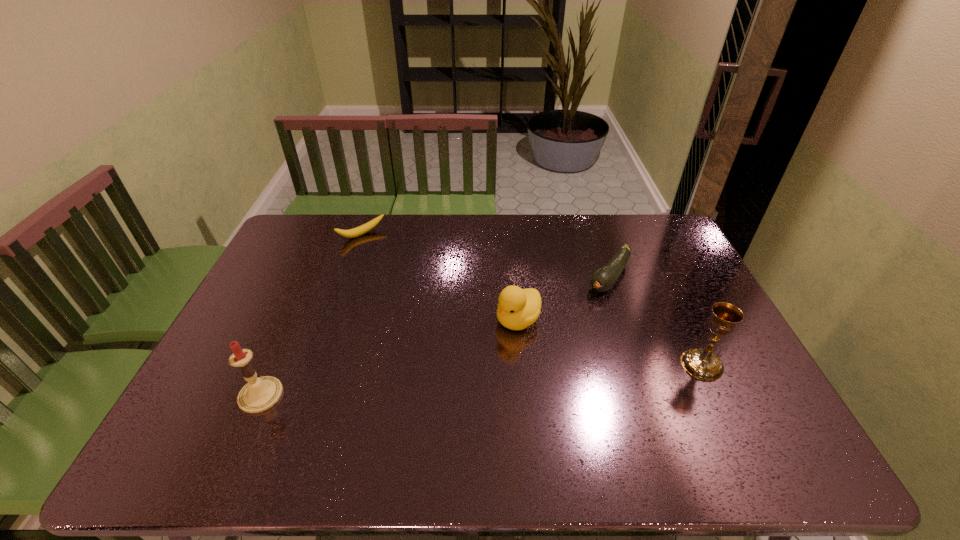
I want to click on vacant area situated 0.270m at the blossom end of the second farthest object, so click(551, 346).

Where is `free location located 0.170m at the blossom end of the second farthest object`? free location located 0.170m at the blossom end of the second farthest object is located at coordinates (570, 326).

Where is `vacant space situated on the front-facing side of the duck`? Image resolution: width=960 pixels, height=540 pixels. vacant space situated on the front-facing side of the duck is located at coordinates (444, 384).

Image resolution: width=960 pixels, height=540 pixels. What are the coordinates of `free space located 0.360m on the front-facing side of the duck` in the screenshot? It's located at (409, 414).

Where is `vacant area situated 0.090m on the front-facing side of the duck`? vacant area situated 0.090m on the front-facing side of the duck is located at coordinates pos(483,350).

You are a GUI agent. You are given a task and a screenshot of the screen. Output one action in this format:
    pyautogui.click(x=<x>, y=<y>)
    Task: Click on the vacant region located 0.240m on the upward curve of the banana
    This screenshot has height=540, width=960.
    Given the screenshot: What is the action you would take?
    pyautogui.click(x=402, y=278)

Image resolution: width=960 pixels, height=540 pixels. Find the location of `blank space located 0.390m on the upward curve of the banana`. blank space located 0.390m on the upward curve of the banana is located at coordinates (425, 304).

The image size is (960, 540). I want to click on free location located 0.260m on the upward curve of the banana, so click(405, 281).

Where is `object present at the far edge`? This screenshot has width=960, height=540. object present at the far edge is located at coordinates (360, 230).

Where is `object that is at the near edge`? The height and width of the screenshot is (540, 960). object that is at the near edge is located at coordinates (260, 394).